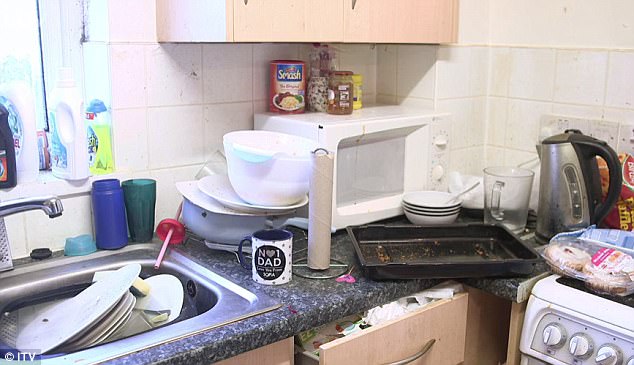
You are a GUI agent. You are given a task and a screenshot of the screen. Output one action in this format:
    pyautogui.click(x=<x>, y=<y>)
    Task: Click on the cup
    The image size is (634, 365).
    Given the screenshot: What is the action you would take?
    pyautogui.click(x=146, y=200), pyautogui.click(x=269, y=257)